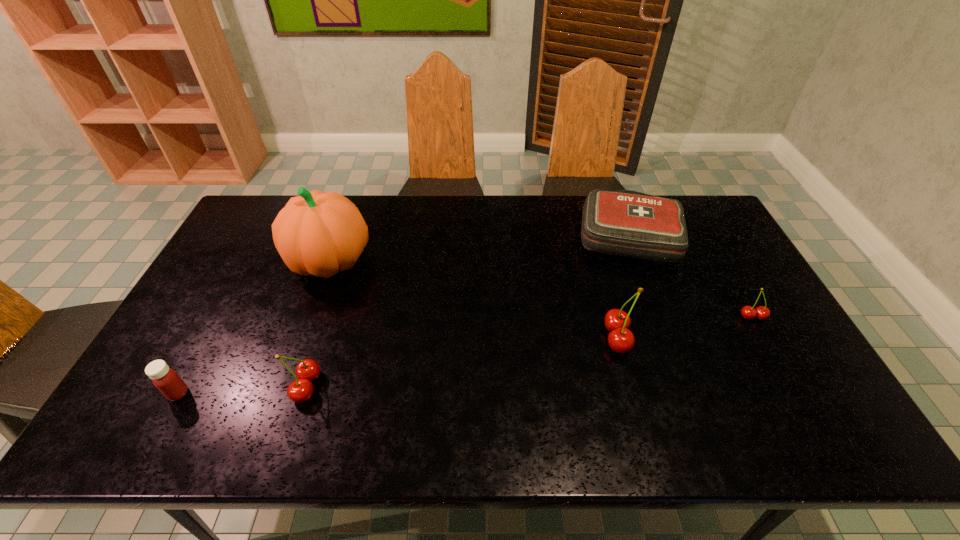
You are a GUI agent. You are given a task and a screenshot of the screen. Output one action in this format:
    pyautogui.click(x=<x>, y=<y>)
    Task: Click on the vacant spot for a new cherry to ensure equal spacing
    The height and width of the screenshot is (540, 960).
    Given the screenshot: What is the action you would take?
    pyautogui.click(x=469, y=361)